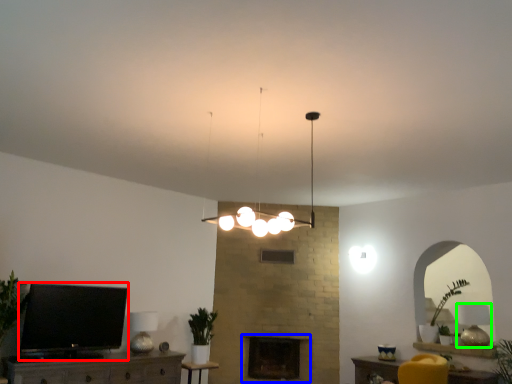
Question: Which object is positioned farthest from television (highlighted by a red box)? Select from fireplace (highlighted by a blue box) and lamp (highlighted by a green box).

Choices:
 (A) fireplace
 (B) lamp

Answer: (B)